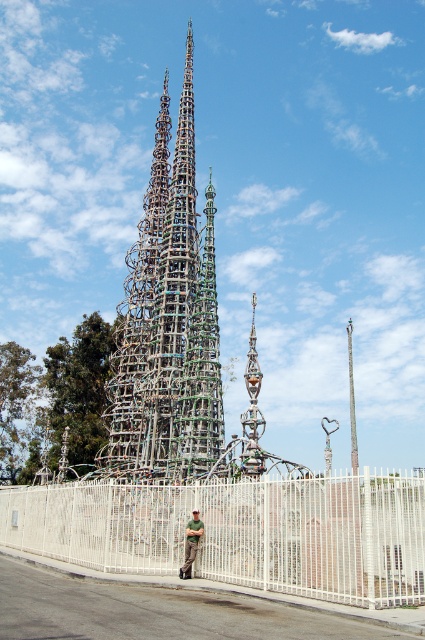
You are a photographer wanting to capture the multicolored metal sculpture at center and the green leafy tree at left in a single frame. Which object should you position closer to the camera to ensure both are in focus?

The multicolored metal sculpture at center is much taller than the green leafy tree at left, so positioning the camera closer to the sculpture will help ensure both are in focus as the tree is shorter and closer to the same plane.

You are a photographer trying to capture a photo of the green leafy tree at center and the green matte shirt at center in the sculpture area. Since you want both subjects to be clearly visible in the frame, which subject should you focus on first to ensure it appears in focus?

The green leafy tree at center is much taller than the green matte shirt at center, so you should focus on the green leafy tree at center first since it is larger and more prominent in the frame.

You are a photographer standing at the base of the sculpture. You want to take a photo that includes both the green leafy tree at left and the green matte shirt at center. Considering their distance apart, is it possible to frame both in a single shot without moving your position?

The green leafy tree at left is 95.09 meters away from the green matte shirt at center, so it is possible to frame both in a single shot without moving your position since the distance between them is within the camera lens range.